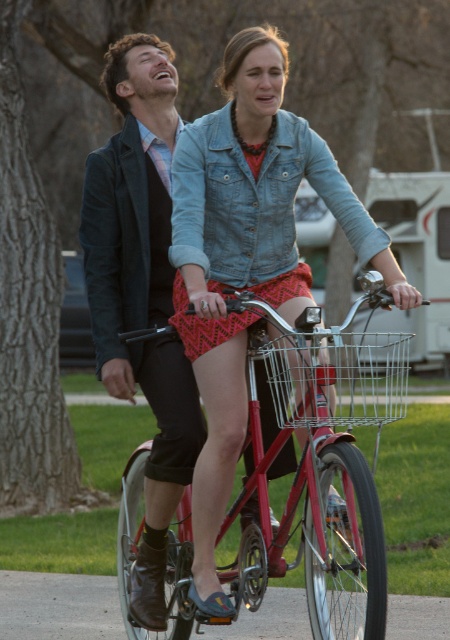
Between metallic red bicycle at center and velvet black jacket at left, which one has less height?

With less height is metallic red bicycle at center.

Does metallic red bicycle at center appear on the right side of velvet black jacket at left?

Indeed, metallic red bicycle at center is positioned on the right side of velvet black jacket at left.

Locate an element on the screen. Image resolution: width=450 pixels, height=640 pixels. metallic red bicycle at center is located at coordinates tap(322, 464).

Is point (181, 490) positioned after point (310, 381)?

Yes, it is behind point (310, 381).

Is point (166, 51) closer to viewer compared to point (315, 364)?

No, it is behind (315, 364).

Who is more distant from viewer, (166, 182) or (355, 365)?

Positioned behind is point (166, 182).

Find the location of a particular element. This screenshot has height=640, width=450. velvet black jacket at left is located at coordinates (142, 291).

Based on the photo, is metallic red bicycle at center bigger than wire mesh basket at center?

Yes, metallic red bicycle at center is bigger than wire mesh basket at center.

Does metallic red bicycle at center have a smaller size compared to wire mesh basket at center?

Incorrect, metallic red bicycle at center is not smaller in size than wire mesh basket at center.

Where is `metallic red bicycle at center`? metallic red bicycle at center is located at coordinates (322, 464).

Find the location of a particular element. This screenshot has width=450, height=640. metallic red bicycle at center is located at coordinates (322, 464).